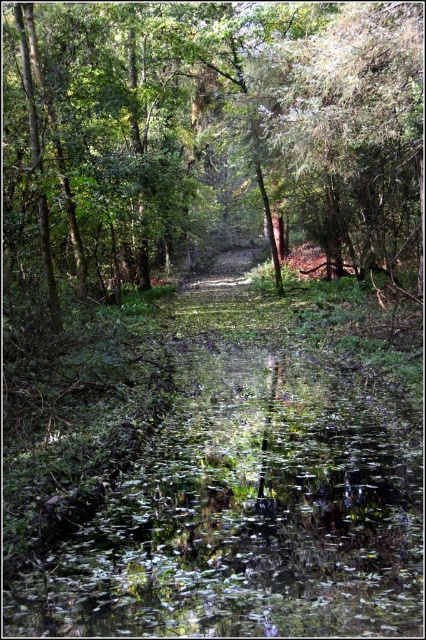
You are standing at the point labeled point (x=129, y=573) in the forest. You want to walk to a tree that is exactly 4.44 meters away from your current position. Which tree should you head towards?

You should head towards the tree that is exactly 4.44 meters away from the point labeled point (x=129, y=573).

You are a hiker trying to navigate the forest path. You see the green leafy water at center and the green leafy tree at upper right. Which object is closer to you as you stand on the path?

The green leafy water at center is closer to you because it is in front of the green leafy tree at upper right.